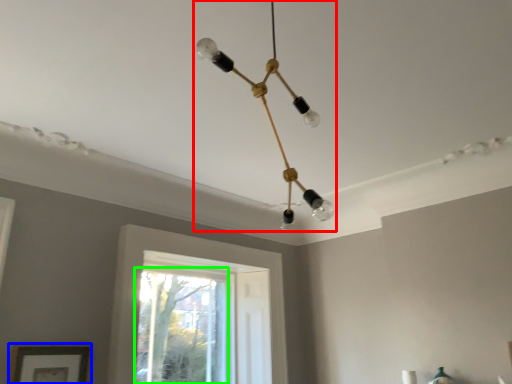
Question: Estimate the real-world distances between objects in this image. Which object is farther from lamp (highlighted by a red box), picture frame (highlighted by a blue box) or window (highlighted by a green box)?

Choices:
 (A) picture frame
 (B) window

Answer: (B)